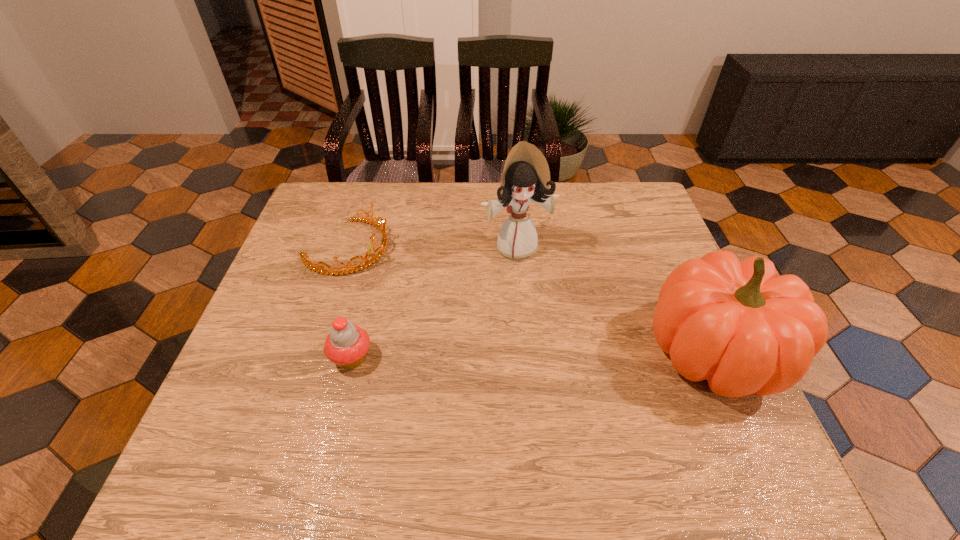
You are a GUI agent. You are given a task and a screenshot of the screen. Output one action in this format:
    pyautogui.click(x=<x>, y=<y>)
    Task: Click on the vacant area between the shortest object and the doll
    The image size is (960, 540).
    Given the screenshot: What is the action you would take?
    pyautogui.click(x=432, y=247)

Image resolution: width=960 pixels, height=540 pixels. What are the coordinates of `empty space that is in between the third object from left to right and the cupcake` in the screenshot? It's located at (434, 302).

You are a GUI agent. You are given a task and a screenshot of the screen. Output one action in this format:
    pyautogui.click(x=<x>, y=<y>)
    Task: Click on the free space between the third object from left to right and the shortest object
    The width and height of the screenshot is (960, 540).
    Given the screenshot: What is the action you would take?
    pyautogui.click(x=432, y=247)

The image size is (960, 540). In order to click on object that stands as the third closest to the second object from right to left in this screenshot , I will do `click(346, 345)`.

You are a GUI agent. You are given a task and a screenshot of the screen. Output one action in this format:
    pyautogui.click(x=<x>, y=<y>)
    Task: Click on the object that can be found as the second closest to the cupcake
    This screenshot has width=960, height=540.
    Given the screenshot: What is the action you would take?
    pyautogui.click(x=526, y=177)

Find the location of a particular element. vacant space that satisfies the following two spatial constraints: 1. on the back side of the rightmost object; 2. on the right side of the second shortest object is located at coordinates (353, 351).

Locate an element on the screen. The width and height of the screenshot is (960, 540). blank area in the image that satisfies the following two spatial constraints: 1. on the front side of the rightmost object; 2. on the left side of the tiara is located at coordinates (313, 351).

Find the location of a particular element. The height and width of the screenshot is (540, 960). free space in the image that satisfies the following two spatial constraints: 1. on the front side of the third tallest object; 2. on the left side of the shortest object is located at coordinates (x=311, y=357).